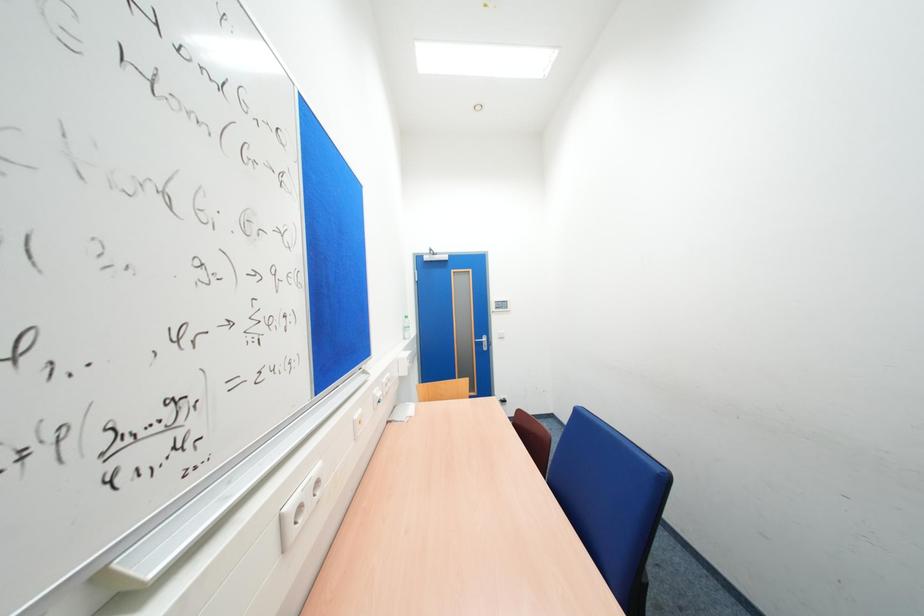
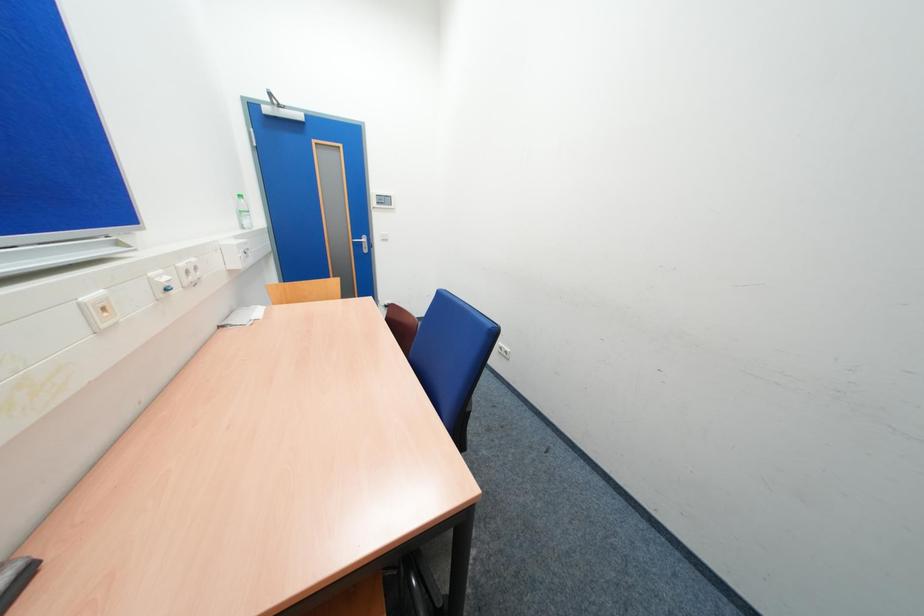
The first image is from the beginning of the video and the second image is from the end. How did the camera likely rotate when shooting the video?

The camera's rotation is toward right-down.